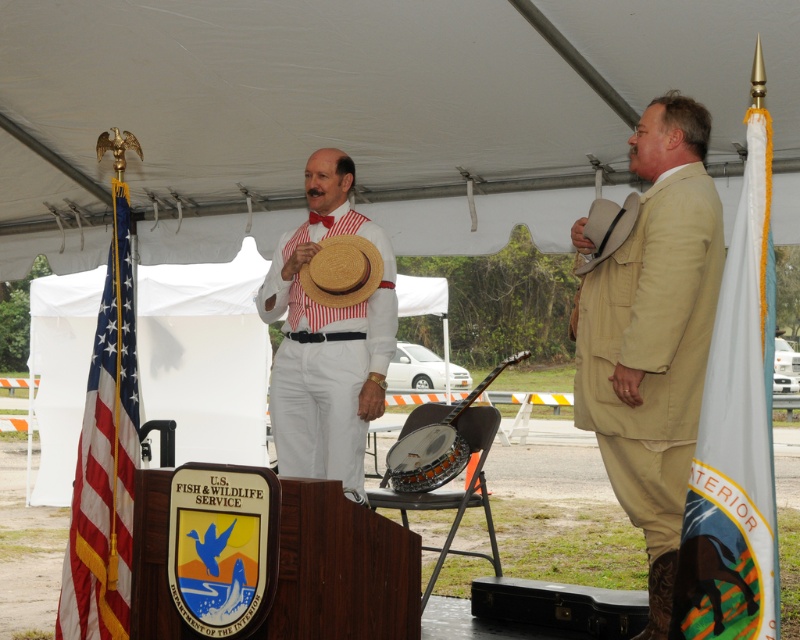
You are a photographer positioned behind the stage. You need to capture a photo that includes both the tan fabric suit at right and the white striped fabric at center. What is the minimum distance you should move forward to ensure both are in frame?

The tan fabric suit at right and white striped fabric at center are 1.02 meters apart from each other. To ensure both are in frame, you should move forward until your camera can capture at least 1.02 meters width.

You are an event planner arranging a photo shoot. You need to position a camera so that both the tan fabric suit at right and the white striped fabric at center are visible in the frame. Based on their positions, which object should be placed closer to the camera to ensure both are in the shot?

The tan fabric suit at right is in front of the white striped fabric at center, so placing the camera closer to the tan fabric suit at right will keep both objects in the frame without one blocking the other.